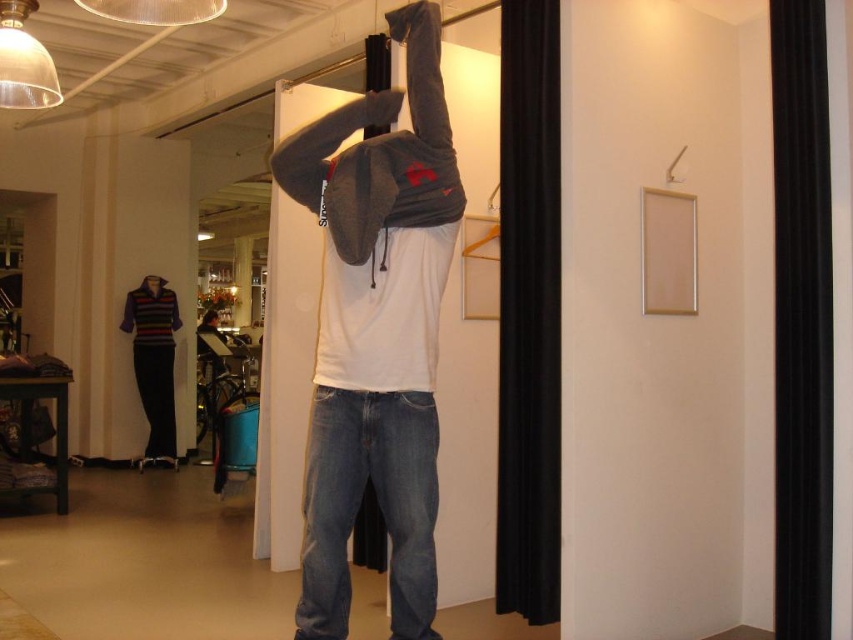
Who is positioned more to the left, matte gray hoodie at center or wooden hanger at upper center?

matte gray hoodie at center

Which of these two, matte gray hoodie at center or wooden hanger at upper center, stands shorter?

wooden hanger at upper center

The height and width of the screenshot is (640, 853). Describe the element at coordinates (376, 330) in the screenshot. I see `matte gray hoodie at center` at that location.

Locate an element on the screen. This screenshot has height=640, width=853. matte gray hoodie at center is located at coordinates (376, 330).